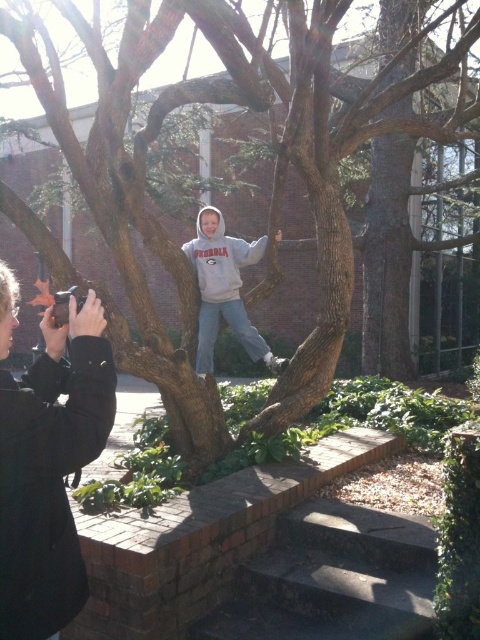
Question: Which point is closer to the camera?

Choices:
 (A) dark gray concrete stairs at lower center
 (B) black fabric camera at lower left
 (C) gray fleece sweatshirt at center
 (D) gray fleece hoodie at center

Answer: (B)

Question: Which point is farther from the camera taking this photo?

Choices:
 (A) (41, 464)
 (B) (233, 620)
 (C) (231, 282)

Answer: (C)

Question: Which object is the closest to the gray fleece hoodie at center?

Choices:
 (A) dark gray concrete stairs at lower center
 (B) gray fleece sweatshirt at center

Answer: (B)

Question: Can you confirm if dark gray concrete stairs at lower center is positioned below gray fleece sweatshirt at center?

Choices:
 (A) no
 (B) yes

Answer: (B)

Question: Is dark gray concrete stairs at lower center bigger than gray fleece hoodie at center?

Choices:
 (A) yes
 (B) no

Answer: (B)

Question: Is gray fleece hoodie at center further to camera compared to gray fleece sweatshirt at center?

Choices:
 (A) no
 (B) yes

Answer: (A)